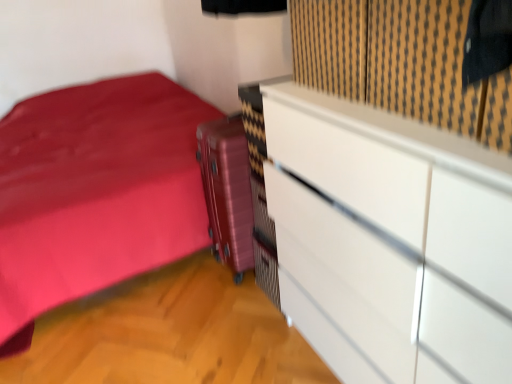
Question: Is white glossy chest of drawers at upper right facing away from metallic pink suitcase at center?

Choices:
 (A) yes
 (B) no

Answer: (B)

Question: Can you confirm if white glossy chest of drawers at upper right is smaller than metallic pink suitcase at center?

Choices:
 (A) yes
 (B) no

Answer: (B)

Question: Is white glossy chest of drawers at upper right to the right of metallic pink suitcase at center from the viewer's perspective?

Choices:
 (A) yes
 (B) no

Answer: (A)

Question: Is white glossy chest of drawers at upper right positioned in front of metallic pink suitcase at center?

Choices:
 (A) yes
 (B) no

Answer: (A)

Question: Can you confirm if white glossy chest of drawers at upper right is wider than metallic pink suitcase at center?

Choices:
 (A) no
 (B) yes

Answer: (B)

Question: Which is correct: white glossy chest of drawers at upper right is inside metallic pink suitcase at center, or outside of it?

Choices:
 (A) inside
 (B) outside

Answer: (B)

Question: Would you say white glossy chest of drawers at upper right is to the left or to the right of metallic pink suitcase at center in the picture?

Choices:
 (A) right
 (B) left

Answer: (A)

Question: Is white glossy chest of drawers at upper right bigger or smaller than metallic pink suitcase at center?

Choices:
 (A) small
 (B) big

Answer: (B)

Question: Is point (489, 377) positioned closer to the camera than point (232, 153)?

Choices:
 (A) closer
 (B) farther

Answer: (A)

Question: Considering the positions of point (356, 69) and point (374, 185), is point (356, 69) closer or farther from the camera than point (374, 185)?

Choices:
 (A) closer
 (B) farther

Answer: (B)

Question: Considering the relative positions of black textured curtain at upper right and white glossy chest of drawers at upper right in the image provided, is black textured curtain at upper right to the left or to the right of white glossy chest of drawers at upper right?

Choices:
 (A) left
 (B) right

Answer: (B)

Question: Is black textured curtain at upper right bigger or smaller than white glossy chest of drawers at upper right?

Choices:
 (A) big
 (B) small

Answer: (B)

Question: From the image's perspective, relative to white glossy chest of drawers at upper right, is black textured curtain at upper right above or below?

Choices:
 (A) below
 (B) above

Answer: (B)

Question: Relative to black textured curtain at upper right, is metallic pink suitcase at center in front or behind?

Choices:
 (A) behind
 (B) front

Answer: (A)

Question: Visually, is metallic pink suitcase at center positioned to the left or to the right of black textured curtain at upper right?

Choices:
 (A) right
 (B) left

Answer: (B)